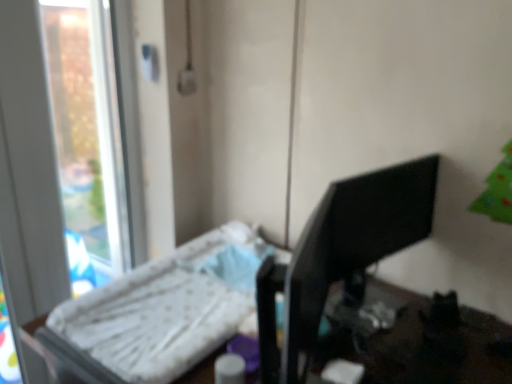
What do you see at coordinates (149, 318) in the screenshot?
I see `white fabric changing table at left` at bounding box center [149, 318].

Where is `white fabric changing table at left`? white fabric changing table at left is located at coordinates (149, 318).

In order to face black glossy monitor at right, should I rotate leftwards or rightwards?

To face it directly, rotate right by 15.117 degrees.

Image resolution: width=512 pixels, height=384 pixels. I want to click on transparent glass window at left, so click(65, 158).

The width and height of the screenshot is (512, 384). What are the coordinates of `white fabric changing table at left` in the screenshot? It's located at (149, 318).

Is white fabric changing table at left far from transparent glass window at left?

No, white fabric changing table at left is not far from transparent glass window at left.

Locate an element on the screen. window that appears above the white fabric changing table at left (from a real-world perspective) is located at coordinates (65, 158).

What's the angular difference between white fabric changing table at left and transparent glass window at left's facing directions?

The angular difference between white fabric changing table at left and transparent glass window at left is 90 degrees.

Is white fabric changing table at left not inside transparent glass window at left?

Indeed, white fabric changing table at left is completely outside transparent glass window at left.

In the image, is black glossy monitor at right positioned in front of or behind white fabric changing table at left?

black glossy monitor at right is positioned farther from the viewer than white fabric changing table at left.

Is black glossy monitor at right positioned with its back to white fabric changing table at left?

No, black glossy monitor at right is not facing away from white fabric changing table at left.

How many degrees apart are the facing directions of black glossy monitor at right and white fabric changing table at left?

black glossy monitor at right and white fabric changing table at left are facing 91 degrees away from each other.

From the image's perspective, is black glossy monitor at right above white fabric changing table at left?

Yes, from the image's perspective, black glossy monitor at right is above white fabric changing table at left.

Considering the sizes of objects black glossy monitor at right and transparent glass window at left in the image provided, who is taller, black glossy monitor at right or transparent glass window at left?

transparent glass window at left.

Can you confirm if black glossy monitor at right is wider than transparent glass window at left?

Correct, the width of black glossy monitor at right exceeds that of transparent glass window at left.

From the image's perspective, is black glossy monitor at right above or below transparent glass window at left?

black glossy monitor at right is below transparent glass window at left.

Image resolution: width=512 pixels, height=384 pixels. Find the location of `furniture lying below the transparent glass window at left (from the image's perspective)`. furniture lying below the transparent glass window at left (from the image's perspective) is located at coordinates (149, 318).

From the image's perspective, which is above, transparent glass window at left or white fabric changing table at left?

transparent glass window at left.

Is white fabric changing table at left at the back of transparent glass window at left?

No, transparent glass window at left is not facing away from white fabric changing table at left.

Would you say transparent glass window at left contains black glossy monitor at right?

No, black glossy monitor at right is not surrounded by transparent glass window at left.

Which object is more forward, transparent glass window at left or black glossy monitor at right?

Positioned in front is black glossy monitor at right.

Based on their positions, is transparent glass window at left located to the left or right of black glossy monitor at right?

Clearly, transparent glass window at left is on the left of black glossy monitor at right in the image.

Is transparent glass window at left smaller than black glossy monitor at right?

Yes.

From a real-world perspective, is white fabric changing table at left on top of black glossy monitor at right?

No, from a real-world perspective, white fabric changing table at left is not over black glossy monitor at right

Does point (146, 277) appear closer or farther from the camera than point (301, 266)?

Point (146, 277) is farther from the camera than point (301, 266).

Considering the positions of objects white fabric changing table at left and black glossy monitor at right in the image provided, who is behind, white fabric changing table at left or black glossy monitor at right?

black glossy monitor at right is further from the camera.

The width and height of the screenshot is (512, 384). In order to click on furniture on the right side of transparent glass window at left in this screenshot , I will do `click(149, 318)`.

At what (x,y) coordinates should I click in order to perform the action: click on desktop computer that is above the white fabric changing table at left (from the image's perspective). Please return your answer as a coordinate pair (x, y). Looking at the image, I should click on (340, 254).

From the image, which object appears to be nearer to white fabric changing table at left, black glossy monitor at right or transparent glass window at left?

black glossy monitor at right is positioned closer to the anchor white fabric changing table at left.

Looking at the image, which one is located closer to black glossy monitor at right, white fabric changing table at left or transparent glass window at left?

white fabric changing table at left is positioned closer to the anchor black glossy monitor at right.

Considering their positions, is white fabric changing table at left positioned further to transparent glass window at left than black glossy monitor at right?

Based on the image, black glossy monitor at right appears to be further to transparent glass window at left.

Looking at the image, which one is located further to white fabric changing table at left, transparent glass window at left or black glossy monitor at right?

transparent glass window at left lies further to white fabric changing table at left than the other object.

Which object lies further to the anchor point transparent glass window at left, black glossy monitor at right or white fabric changing table at left?

black glossy monitor at right lies further to transparent glass window at left than the other object.

Looking at the image, which one is located closer to black glossy monitor at right, transparent glass window at left or white fabric changing table at left?

white fabric changing table at left.

In order to click on furniture between transparent glass window at left and black glossy monitor at right from left to right in this screenshot , I will do `click(149, 318)`.